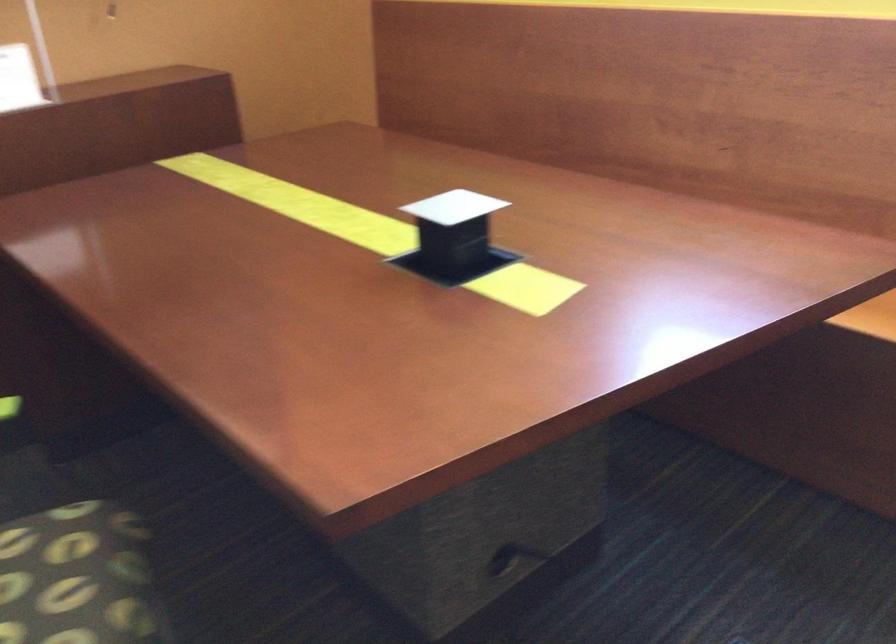
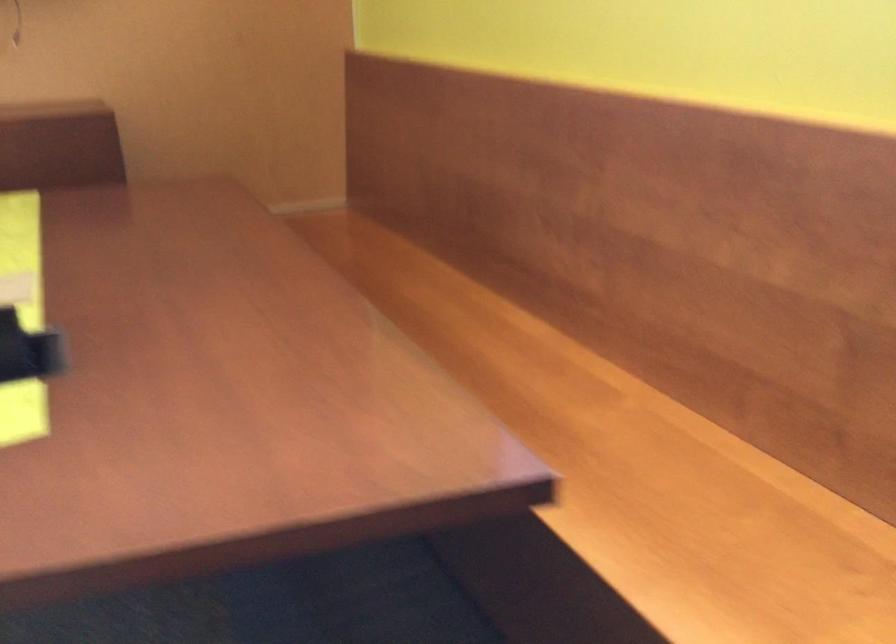
Question: Based on the continuous images, in which direction is the camera rotating? Reply with the corresponding letter.

Choices:
 (A) Left
 (B) Right
 (C) Up
 (D) Down

Answer: (A)